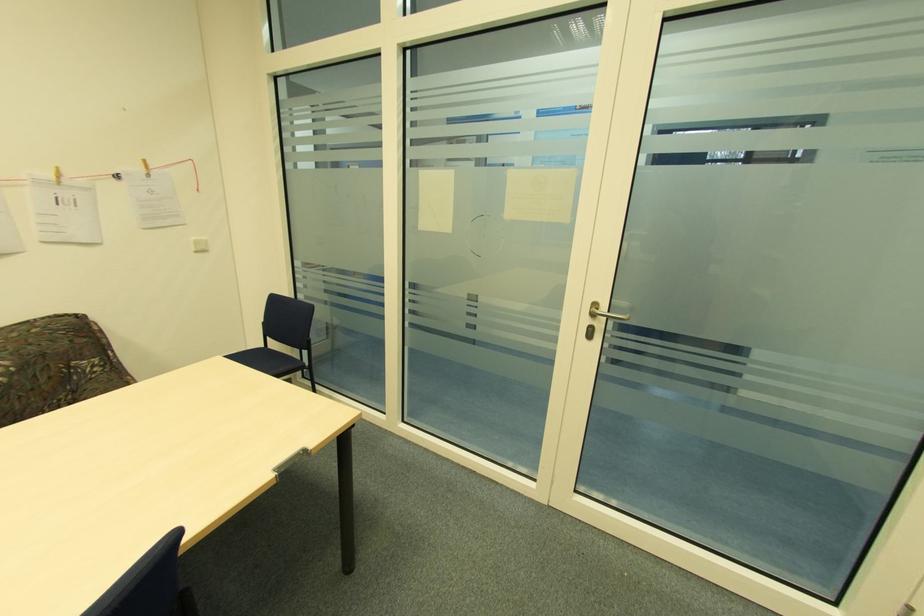
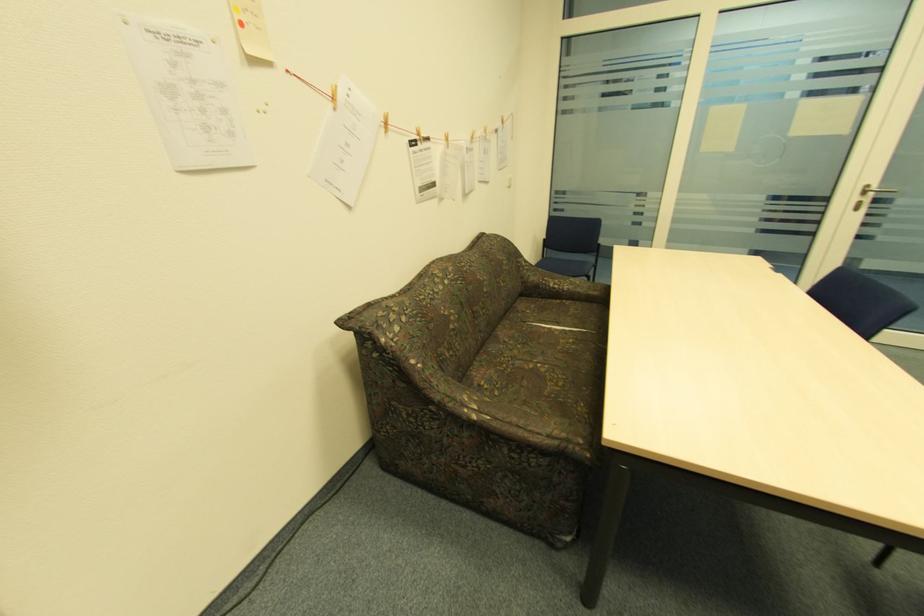
Locate, in the second image, the point that corresponds to the point at 589,321 in the first image.

(859, 199)